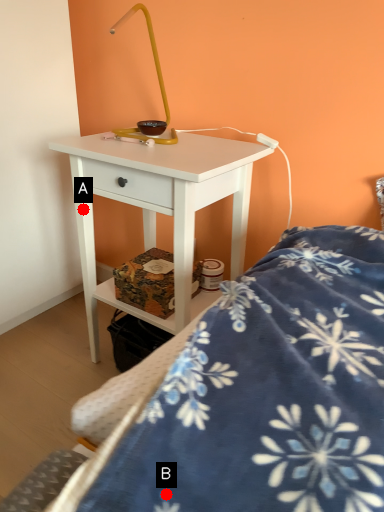
Question: Two points are circled on the image, labeled by A and B beside each circle. Which point is closer to the camera?

Choices:
 (A) A is closer
 (B) B is closer

Answer: (B)